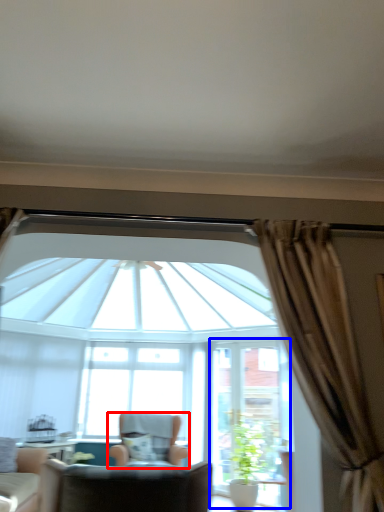
Question: Which of the following is the closest to the observer, chair (highlighted by a red box) or screen door (highlighted by a blue box)?

Choices:
 (A) chair
 (B) screen door

Answer: (A)